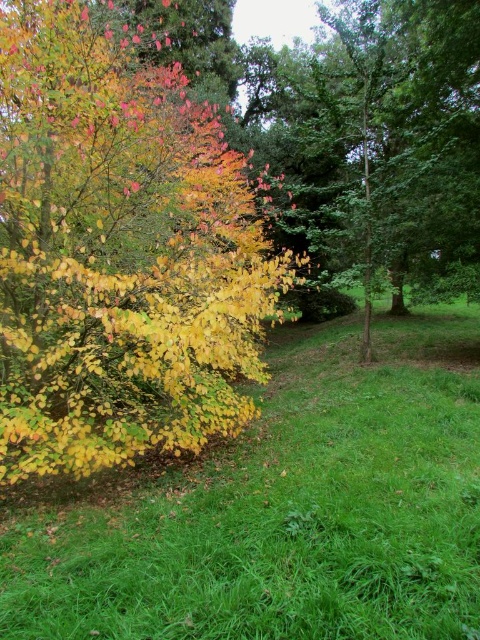
Can you confirm if green grassy at left is wider than yellow-green leaves at left?

Yes.

Can you confirm if green grassy at left is shorter than yellow-green leaves at left?

No.

What do you see at coordinates (288, 509) in the screenshot?
I see `green grassy at left` at bounding box center [288, 509].

Locate an element on the screen. green grassy at left is located at coordinates (288, 509).